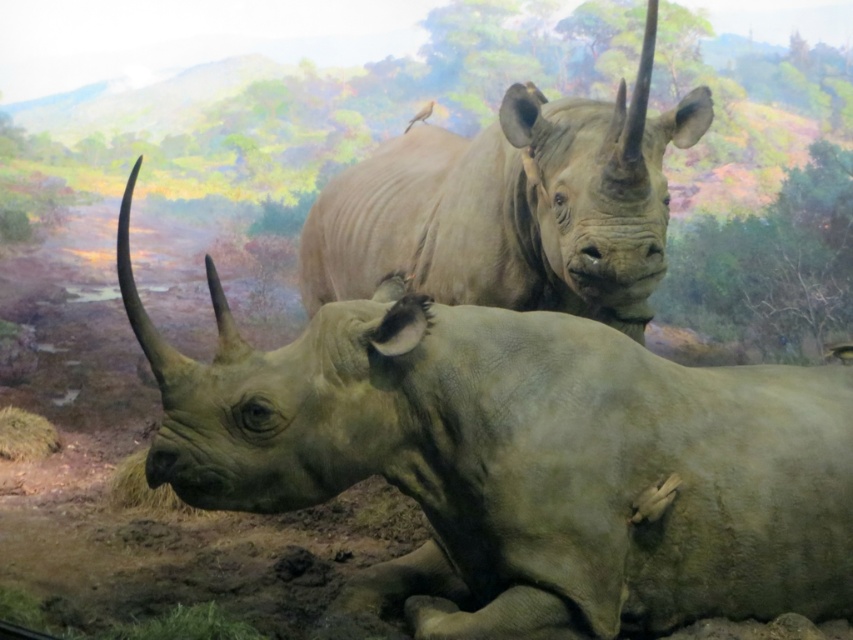
Question: From the image, what is the correct spatial relationship of matte gray rhinoceros at center in relation to matte gray rhinoceros at upper center?

Choices:
 (A) above
 (B) below

Answer: (B)

Question: Which of the following is the farthest from the observer?

Choices:
 (A) (590, 218)
 (B) (643, 422)

Answer: (A)

Question: In this image, where is matte gray rhinoceros at center located relative to matte gray rhinoceros at upper center?

Choices:
 (A) below
 (B) above

Answer: (A)

Question: Can you confirm if matte gray rhinoceros at center is positioned to the right of matte gray rhinoceros at upper center?

Choices:
 (A) no
 (B) yes

Answer: (A)